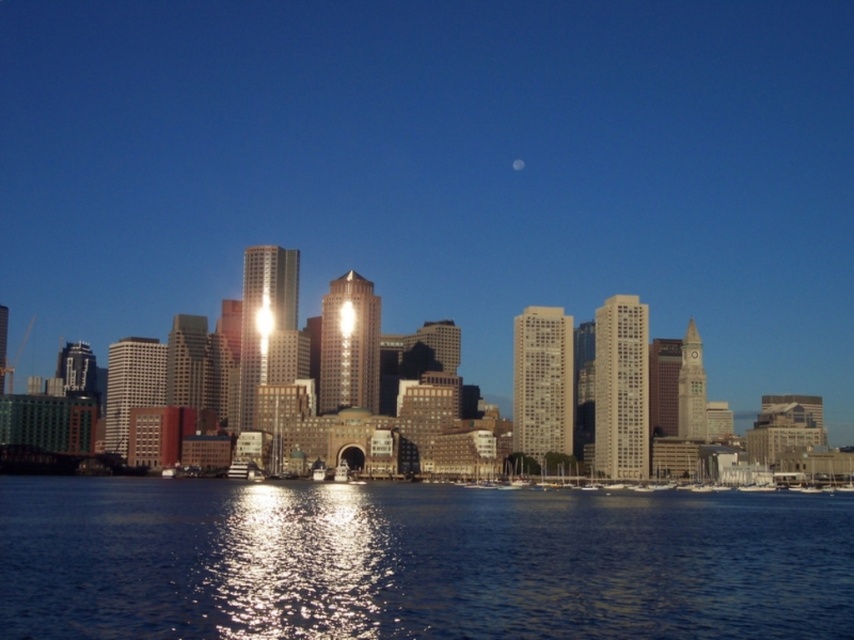
Can you confirm if shiny blue water at lower center is thinner than silvery metallic moon at center?

No.

Which is in front, point (489, 563) or point (344, 312)?

Point (489, 563)

I want to click on shiny blue water at lower center, so click(414, 563).